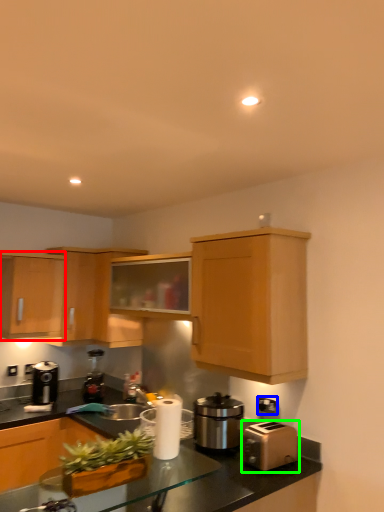
Question: Estimate the real-world distances between objects in this image. Which object is farther from cabinetry (highlighted by a red box), electric outlet (highlighted by a blue box) or toaster (highlighted by a green box)?

Choices:
 (A) electric outlet
 (B) toaster

Answer: (B)